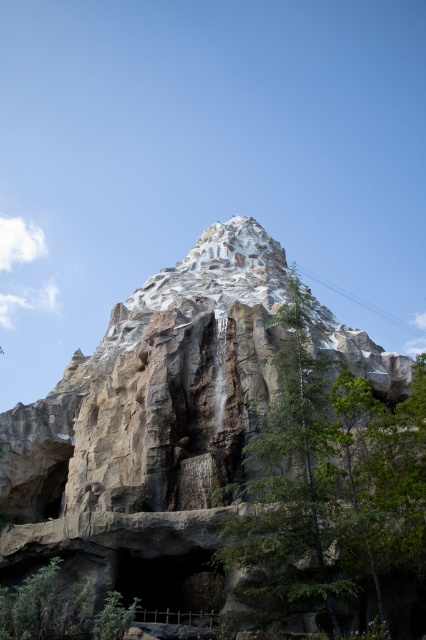
You are a visitor at the theme park and want to take a photo of both the rocky cliff at center and the green leafy tree at center. Since you want them both in the frame, which object should you position closer to the camera to ensure both fit in the photo?

The rocky cliff at center is wider than the green leafy tree at center, so positioning the green leafy tree at center closer to the camera will help both fit in the frame as it is narrower and can be framed without cropping.